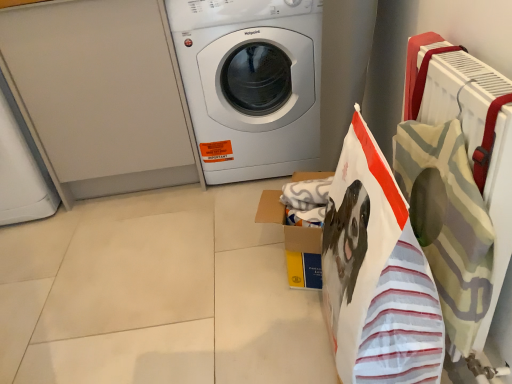
Question: In terms of height, does white striped fabric shopping bag at right look taller or shorter compared to yellow cardboard box at center?

Choices:
 (A) tall
 (B) short

Answer: (A)

Question: In terms of width, does white striped fabric shopping bag at right look wider or thinner when compared to yellow cardboard box at center?

Choices:
 (A) thin
 (B) wide

Answer: (A)

Question: Which object is the closest to the white striped fabric shopping bag at right?

Choices:
 (A) yellow cardboard box at center
 (B) white glossy washing machine at center

Answer: (A)

Question: Based on their relative distances, which object is farther from the yellow cardboard box at center?

Choices:
 (A) white striped fabric shopping bag at right
 (B) white glossy washing machine at center

Answer: (B)